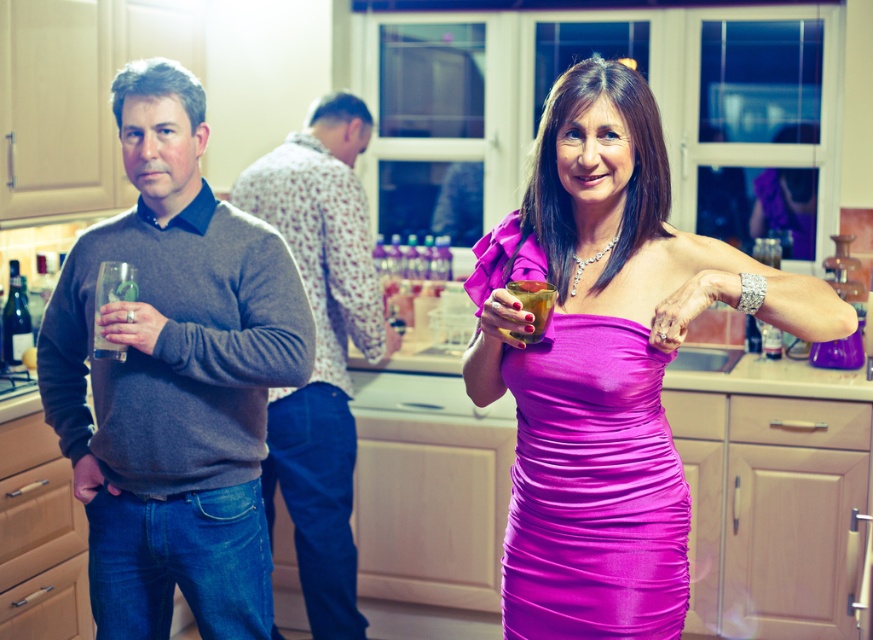
Does satin pink dress at center have a greater height compared to dark red glass bottle at left?

Correct, satin pink dress at center is much taller as dark red glass bottle at left.

Is the position of satin pink dress at center less distant than that of dark red glass bottle at left?

Yes, satin pink dress at center is closer to the viewer.

Where is `satin pink dress at center`? The width and height of the screenshot is (873, 640). satin pink dress at center is located at coordinates (593, 488).

Where is `satin pink dress at center`? The height and width of the screenshot is (640, 873). satin pink dress at center is located at coordinates (593, 488).

Who is positioned more to the right, gray sweater at left or flannel shirt at center?

flannel shirt at center

Does gray sweater at left have a smaller size compared to flannel shirt at center?

Indeed, gray sweater at left has a smaller size compared to flannel shirt at center.

Which is in front, point (210, 269) or point (324, 173)?

Point (210, 269)

You are a GUI agent. You are given a task and a screenshot of the screen. Output one action in this format:
    pyautogui.click(x=<x>, y=<y>)
    Task: Click on the gray sweater at left
    Image resolution: width=873 pixels, height=640 pixels.
    Given the screenshot: What is the action you would take?
    pyautogui.click(x=174, y=380)

Does shiny satin dress at center come behind dark red glass bottle at left?

That is False.

Is shiny satin dress at center thinner than dark red glass bottle at left?

Incorrect, shiny satin dress at center's width is not less than dark red glass bottle at left's.

Is point (513, 536) closer to viewer compared to point (7, 364)?

That is True.

Locate an element on the screen. shiny satin dress at center is located at coordinates (605, 362).